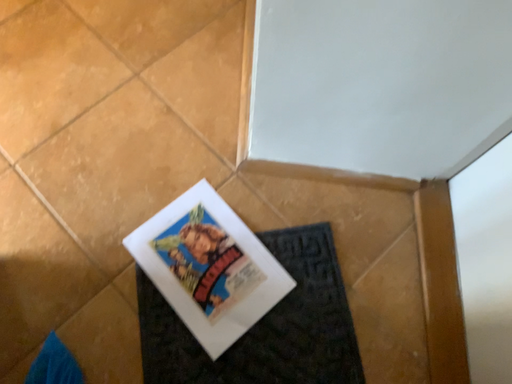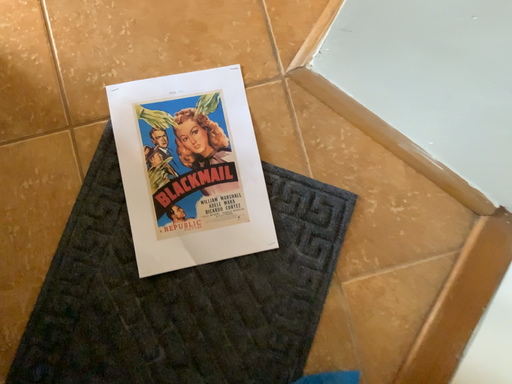
Question: Which way did the camera rotate in the video?

Choices:
 (A) rotated upward
 (B) rotated downward

Answer: (B)